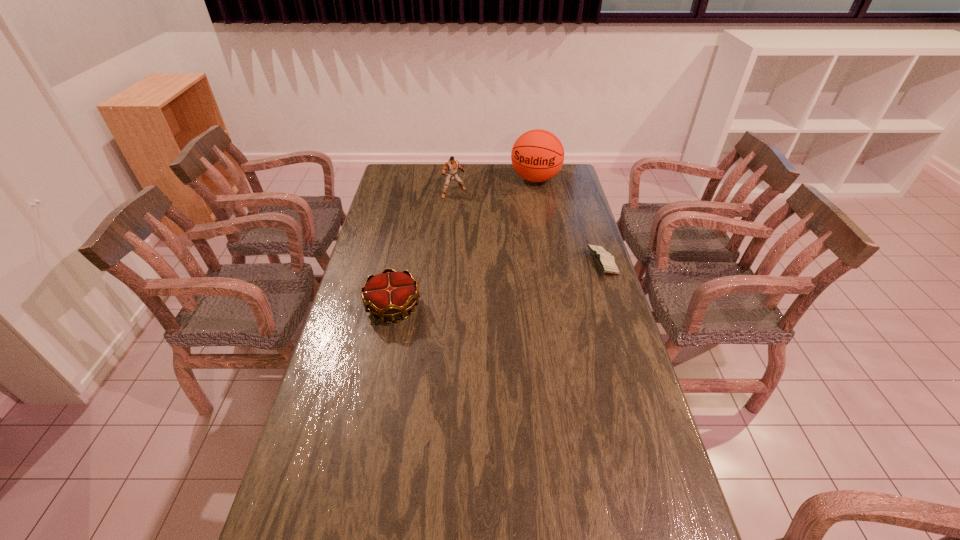
This screenshot has height=540, width=960. I want to click on the nearest object, so click(x=387, y=295).

This screenshot has height=540, width=960. Identify the location of crown. (387, 295).

You are a GUI agent. You are given a task and a screenshot of the screen. Output one action in this format:
    pyautogui.click(x=<x>, y=<y>)
    Task: Click on the second nearest object
    The image size is (960, 540).
    Given the screenshot: What is the action you would take?
    pyautogui.click(x=604, y=259)

You are a GUI agent. You are given a task and a screenshot of the screen. Output one action in this format:
    pyautogui.click(x=<x>, y=<y>)
    Task: Click on the shortest object
    The width and height of the screenshot is (960, 540).
    Given the screenshot: What is the action you would take?
    pyautogui.click(x=604, y=259)

Image resolution: width=960 pixels, height=540 pixels. In order to click on basketball in this screenshot , I will do `click(537, 155)`.

Find the location of a particular element. the second object from right to left is located at coordinates (537, 155).

Find the location of a particular element. puncher is located at coordinates [452, 165].

Find the location of a particular element. This screenshot has height=540, width=960. the third shortest object is located at coordinates (452, 165).

The image size is (960, 540). Find the location of `vacant area located 0.120m on the back of the nearest object`. vacant area located 0.120m on the back of the nearest object is located at coordinates (401, 266).

Identify the location of free space located on the back of the diary. The height and width of the screenshot is (540, 960). (582, 199).